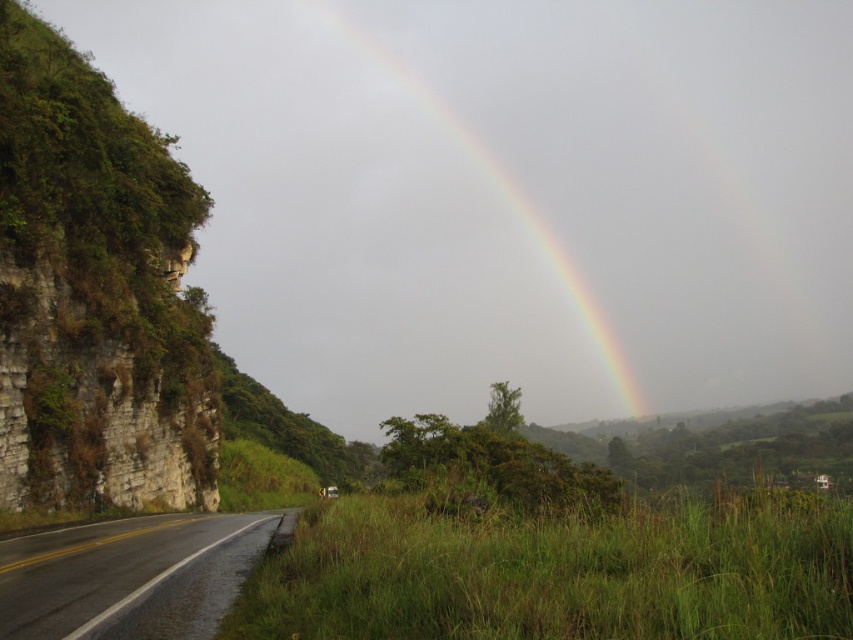
Question: Can you confirm if rocky cliff at left is positioned to the left of rainbow at upper center?

Choices:
 (A) yes
 (B) no

Answer: (A)

Question: Is black asphalt road at lower left above rainbow at upper center?

Choices:
 (A) yes
 (B) no

Answer: (B)

Question: Which point is closer to the camera?

Choices:
 (A) rainbow at upper center
 (B) black asphalt road at lower left
 (C) rocky cliff at left

Answer: (B)

Question: Where is black asphalt road at lower left located in relation to rainbow at upper center in the image?

Choices:
 (A) left
 (B) right

Answer: (A)

Question: Which object is farther from the camera taking this photo?

Choices:
 (A) black asphalt road at lower left
 (B) rocky cliff at left
 (C) rainbow at upper center

Answer: (C)

Question: Which object appears closest to the camera in this image?

Choices:
 (A) rocky cliff at left
 (B) rainbow at upper center
 (C) black asphalt road at lower left

Answer: (C)